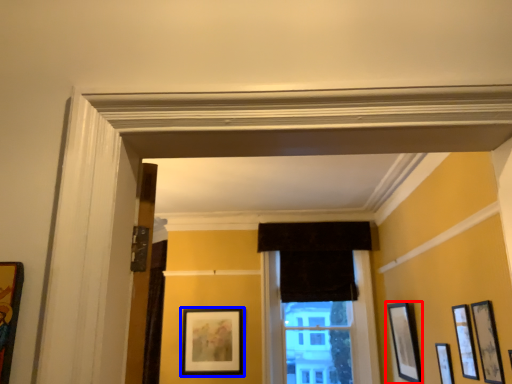
Question: Among these objects, which one is nearest to the camera, picture frame (highlighted by a red box) or picture frame (highlighted by a blue box)?

Choices:
 (A) picture frame
 (B) picture frame

Answer: (A)